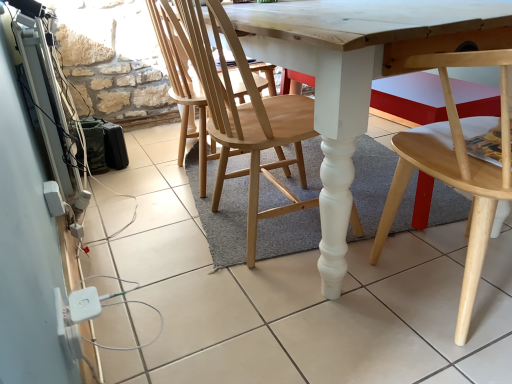
Where is `vacant space underneath natural wood chair at center, the 2th chair when ordered from right to left (from a real-world perspective)`? This screenshot has height=384, width=512. vacant space underneath natural wood chair at center, the 2th chair when ordered from right to left (from a real-world perspective) is located at coordinates (262, 235).